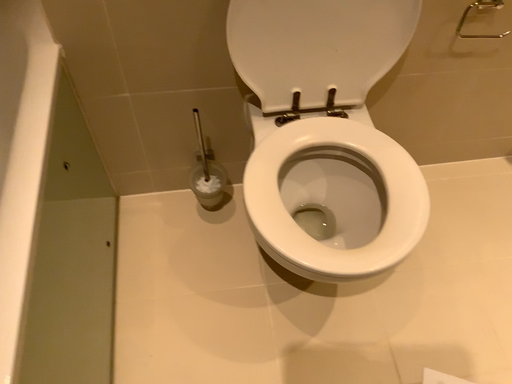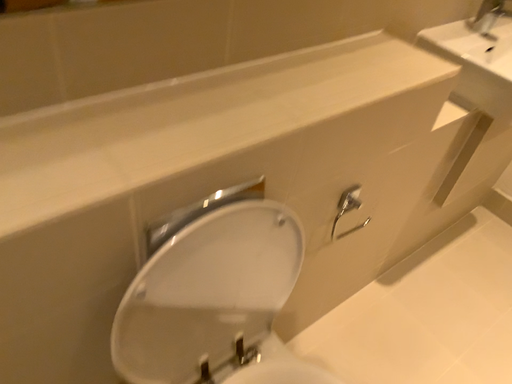
Question: Which way did the camera rotate in the video?

Choices:
 (A) rotated upward
 (B) rotated downward

Answer: (A)